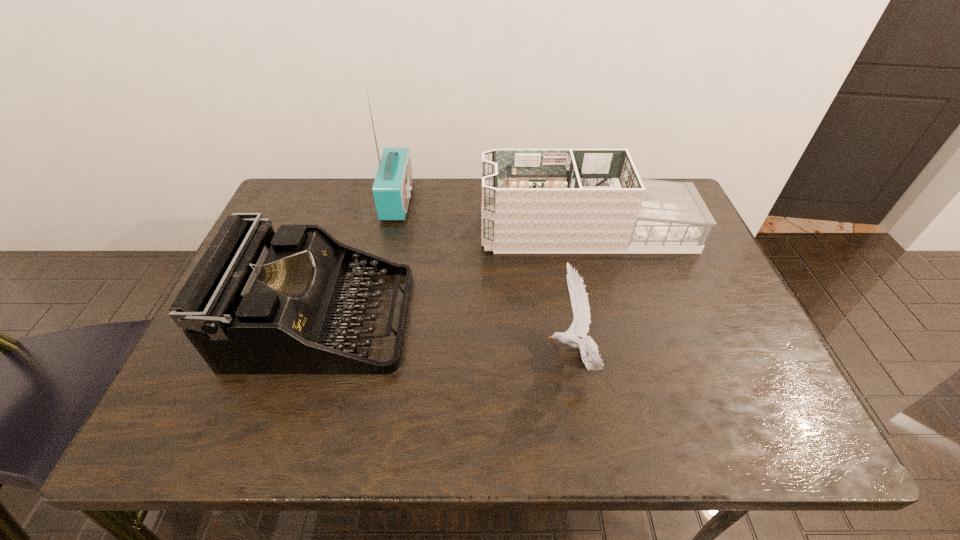
Identify the location of free space at the right edge of the desktop. The image size is (960, 540). (723, 339).

This screenshot has height=540, width=960. In order to click on vacant space at the far left corner in this screenshot , I will do `click(333, 187)`.

Locate an element on the screen. The image size is (960, 540). free area in between the radio receiver and the shortest object is located at coordinates (485, 277).

Locate an element on the screen. Image resolution: width=960 pixels, height=540 pixels. free space between the radio receiver and the gull is located at coordinates (485, 277).

Find the location of a particular element. blank region between the gull and the radio receiver is located at coordinates click(485, 277).

This screenshot has width=960, height=540. I want to click on free spot between the typewriter and the gull, so click(x=446, y=337).

The image size is (960, 540). I want to click on object that is the third closest one to the shortest object, so click(392, 186).

Identify the location of the third closest object to the tallest object. This screenshot has height=540, width=960. (588, 348).